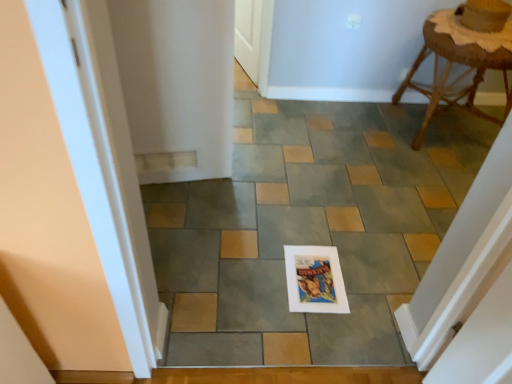
Question: Is white paper at center outside of rattan stool at upper right?

Choices:
 (A) yes
 (B) no

Answer: (A)

Question: Is rattan stool at upper right located within white paper at center?

Choices:
 (A) yes
 (B) no

Answer: (B)

Question: From the image's perspective, is white paper at center on rattan stool at upper right?

Choices:
 (A) yes
 (B) no

Answer: (B)

Question: Can you confirm if white paper at center is positioned to the right of rattan stool at upper right?

Choices:
 (A) no
 (B) yes

Answer: (A)

Question: Is white paper at center at the left side of rattan stool at upper right?

Choices:
 (A) no
 (B) yes

Answer: (B)

Question: Is there a large distance between white paper at center and rattan stool at upper right?

Choices:
 (A) no
 (B) yes

Answer: (A)

Question: Is rattan stool at upper right bigger than white paper at center?

Choices:
 (A) no
 (B) yes

Answer: (A)

Question: Does rattan stool at upper right have a greater height compared to white paper at center?

Choices:
 (A) yes
 (B) no

Answer: (A)

Question: Is rattan stool at upper right positioned far away from white paper at center?

Choices:
 (A) yes
 (B) no

Answer: (B)

Question: Is rattan stool at upper right shorter than white paper at center?

Choices:
 (A) yes
 (B) no

Answer: (B)

Question: Is rattan stool at upper right further to the viewer compared to white paper at center?

Choices:
 (A) yes
 (B) no

Answer: (A)

Question: Is rattan stool at upper right positioned with its back to white paper at center?

Choices:
 (A) yes
 (B) no

Answer: (B)

Question: Looking at their shapes, would you say rattan stool at upper right is wider or thinner than white paper at center?

Choices:
 (A) thin
 (B) wide

Answer: (A)